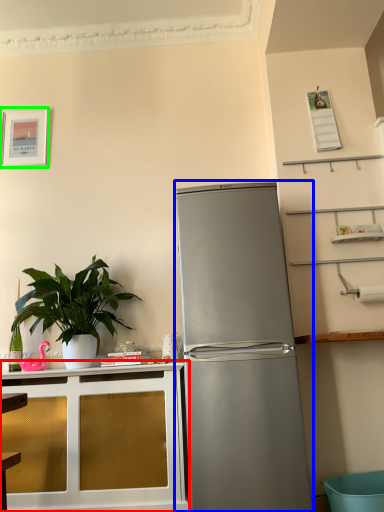
Question: Considering the real-world distances, which object is farthest from cabinetry (highlighted by a red box)? refrigerator (highlighted by a blue box) or picture frame (highlighted by a green box)?

Choices:
 (A) refrigerator
 (B) picture frame

Answer: (B)